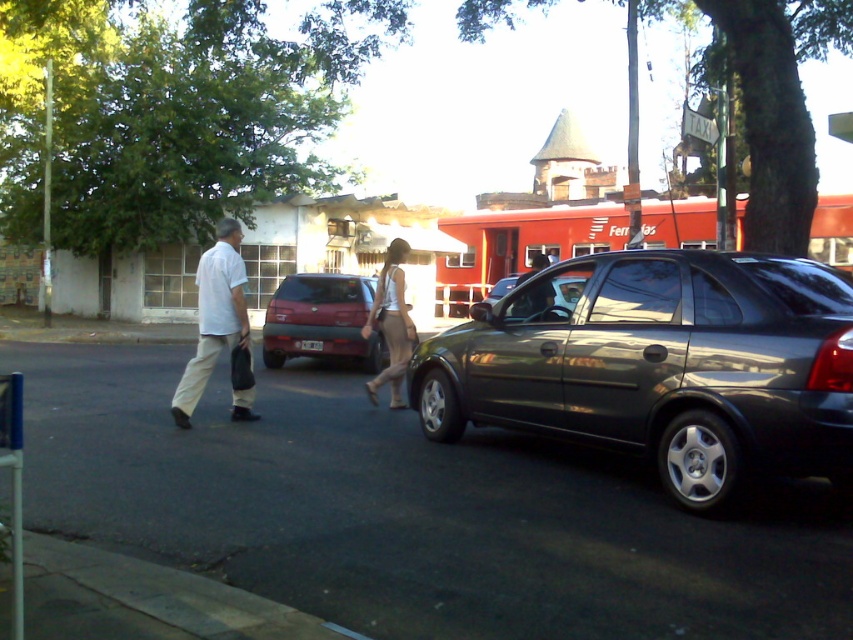
Does white matte shirt at center have a greater height compared to matte black car at center?

Yes.

Is white matte shirt at center further to camera compared to matte black car at center?

Yes, white matte shirt at center is further from the viewer.

Where is `white matte shirt at center`? white matte shirt at center is located at coordinates (213, 316).

Between metallic gray sedan at center and matte black car at center, which one has more height?

Standing taller between the two is matte black car at center.

Can you confirm if metallic gray sedan at center is positioned above matte black car at center?

No, metallic gray sedan at center is not above matte black car at center.

Who is more forward, (444, 433) or (531, 312)?

Positioned in front is point (531, 312).

Identify the location of metallic gray sedan at center. Image resolution: width=853 pixels, height=640 pixels. (663, 368).

What do you see at coordinates (663, 368) in the screenshot? The image size is (853, 640). I see `metallic gray sedan at center` at bounding box center [663, 368].

Can you confirm if metallic gray sedan at center is smaller than matte red hatchback at center?

No.

Who is more forward, (426, 384) or (358, 362)?

Point (426, 384)

Find the location of a particular element. metallic gray sedan at center is located at coordinates (663, 368).